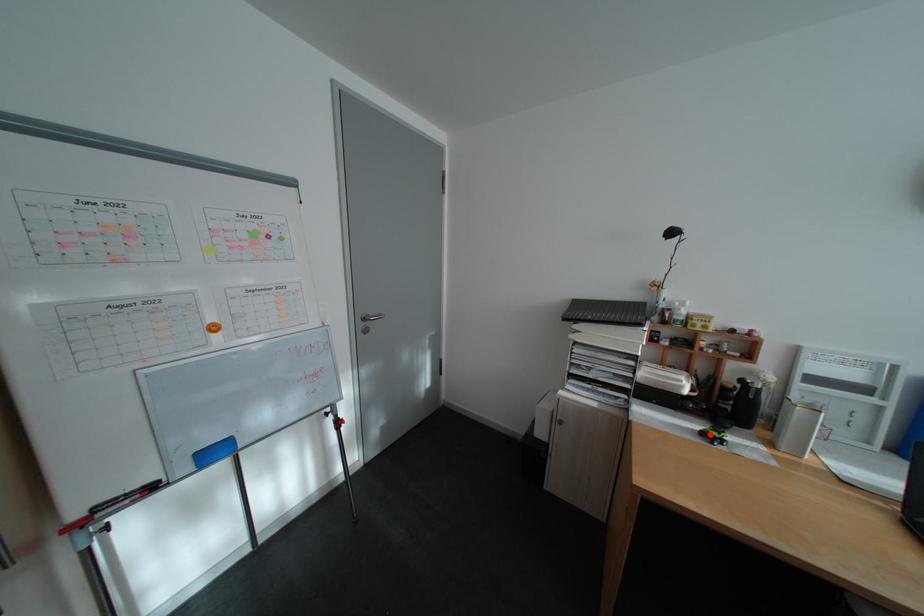
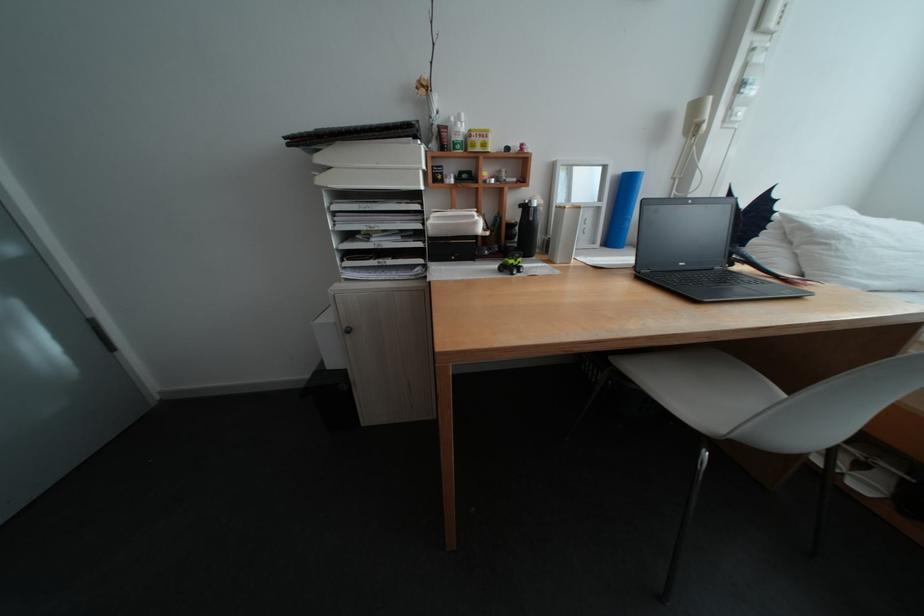
Where in the second image is the point corresponding to the highlighted location from the first image?

(511, 272)